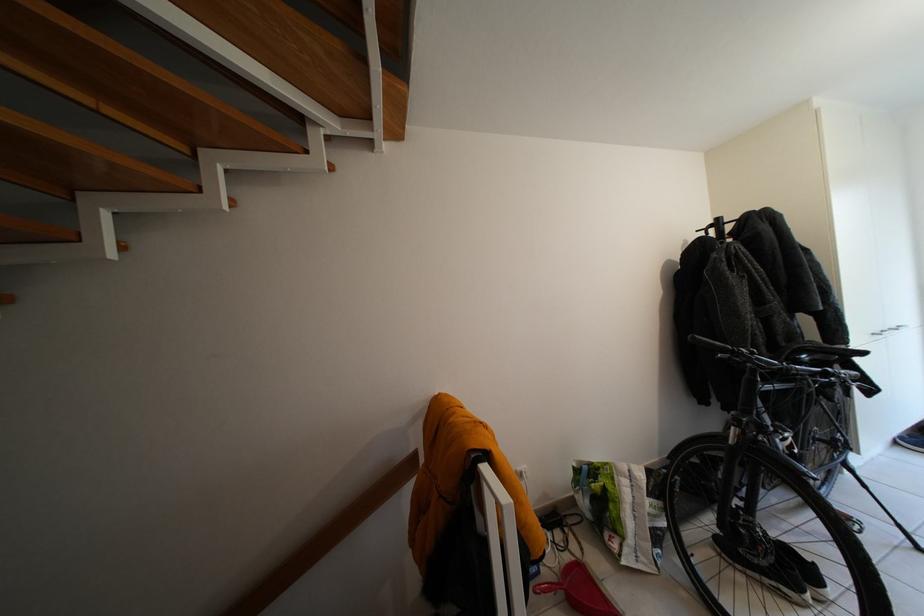
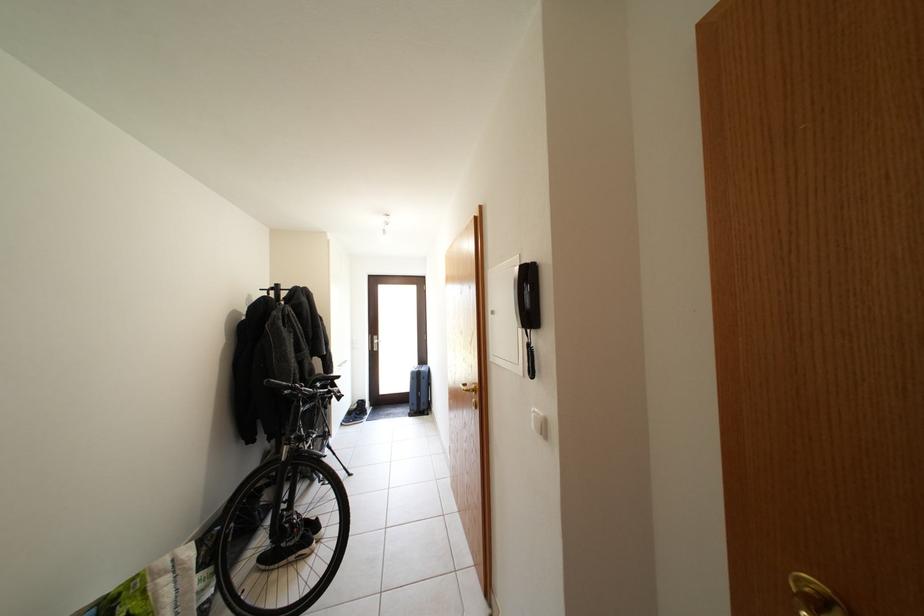
Where in the second image is the point corresponding to [723,350] from the first image?

(289, 390)